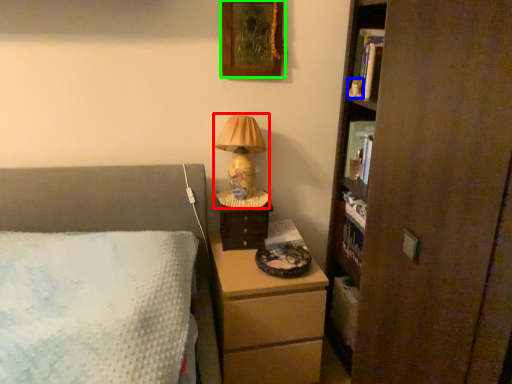
Question: Based on their relative distances, which object is nearer to table lamp (highlighted by a red box)? Choose from toy (highlighted by a blue box) and picture frame (highlighted by a green box).

Choices:
 (A) toy
 (B) picture frame

Answer: (B)